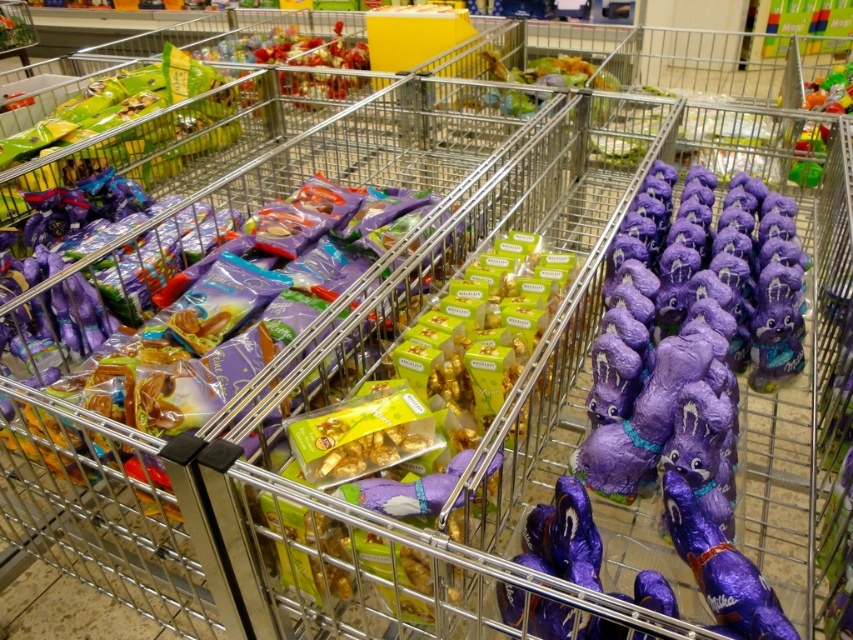
Does purple shiny chocolate bunny at right appear on the left side of purple foil chocolate at center?

In fact, purple shiny chocolate bunny at right is to the right of purple foil chocolate at center.

Does purple shiny chocolate bunny at right lie in front of purple foil chocolate at center?

No.

I want to click on purple shiny chocolate bunny at right, so click(x=689, y=336).

Where is `purple shiny chocolate bunny at right`? Image resolution: width=853 pixels, height=640 pixels. purple shiny chocolate bunny at right is located at coordinates (689, 336).